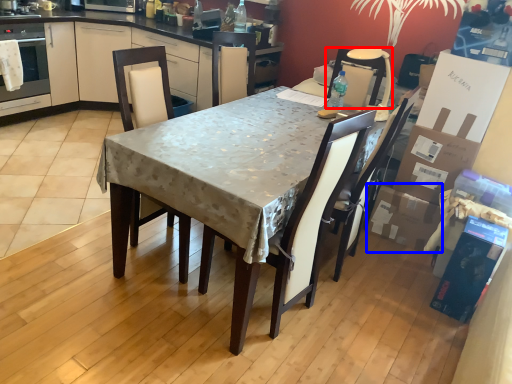
Question: Which object is further to the camera taking this photo, chair (highlighted by a red box) or cardboard box (highlighted by a blue box)?

Choices:
 (A) chair
 (B) cardboard box

Answer: (B)